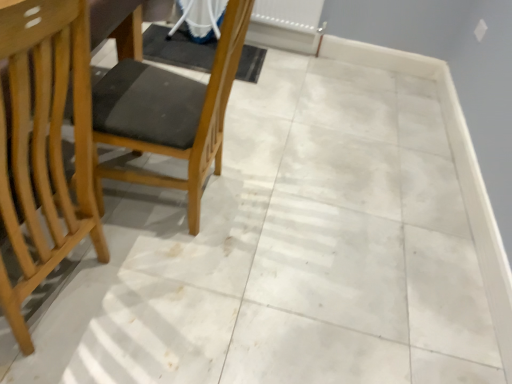
Question: In terms of width, does white plastic radiator at upper center look wider or thinner when compared to light wood chair at left, which is counted as the first chair, starting from the left?

Choices:
 (A) wide
 (B) thin

Answer: (B)

Question: Choose the correct answer: Is white plastic radiator at upper center inside light wood chair at left, which is counted as the first chair, starting from the left, or outside it?

Choices:
 (A) outside
 (B) inside

Answer: (A)

Question: Which is nearer to the light wood chair at left, which is the second chair from right to left?

Choices:
 (A) wooden chair at left, positioned as the 1th chair in right-to-left order
 (B) white plastic radiator at upper center

Answer: (A)

Question: Which of these objects is positioned farthest from the light wood chair at left, which is counted as the first chair, starting from the left?

Choices:
 (A) white plastic radiator at upper center
 (B) wooden chair at left, which appears as the 2th chair when viewed from the left

Answer: (A)